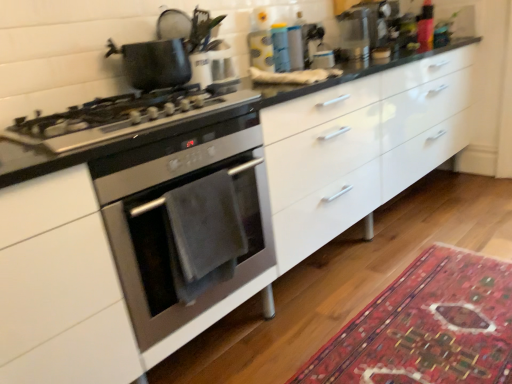
Question: In terms of size, does satin silver gas stove at left appear bigger or smaller than carpet with intricate patterns at lower right?

Choices:
 (A) small
 (B) big

Answer: (B)

Question: Considering the positions of satin silver gas stove at left and carpet with intricate patterns at lower right in the image, is satin silver gas stove at left wider or thinner than carpet with intricate patterns at lower right?

Choices:
 (A) wide
 (B) thin

Answer: (B)

Question: Which is farther from the matte black pot at upper left?

Choices:
 (A) stainless steel oven at left
 (B) satin silver gas stove at left
 (C) carpet with intricate patterns at lower right

Answer: (C)

Question: Estimate the real-world distances between objects in this image. Which object is closer to the stainless steel oven at left?

Choices:
 (A) carpet with intricate patterns at lower right
 (B) satin silver gas stove at left
 (C) matte black pot at upper left

Answer: (B)